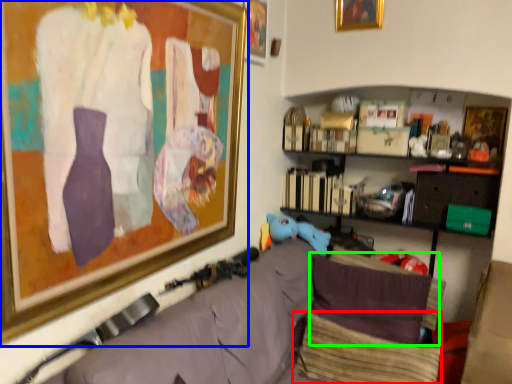
Question: Which is farther away from pillow (highlighted by a red box)? picture frame (highlighted by a blue box) or pillow (highlighted by a green box)?

Choices:
 (A) picture frame
 (B) pillow

Answer: (A)